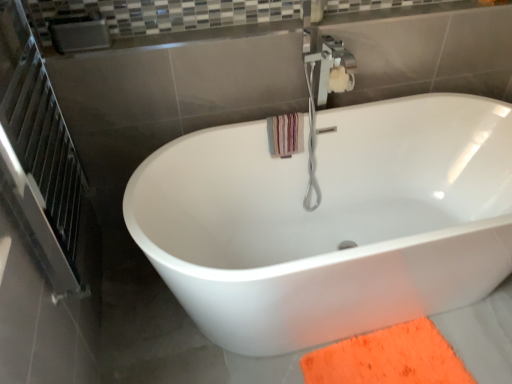
Question: Can you confirm if brushed metal balustrade at upper center is taller than metallic silver screen door at left?

Choices:
 (A) yes
 (B) no

Answer: (B)

Question: From a real-world perspective, is brushed metal balustrade at upper center physically below metallic silver screen door at left?

Choices:
 (A) yes
 (B) no

Answer: (B)

Question: Does brushed metal balustrade at upper center appear on the left side of metallic silver screen door at left?

Choices:
 (A) yes
 (B) no

Answer: (B)

Question: From the image's perspective, is brushed metal balustrade at upper center below metallic silver screen door at left?

Choices:
 (A) no
 (B) yes

Answer: (A)

Question: Does brushed metal balustrade at upper center have a greater width compared to metallic silver screen door at left?

Choices:
 (A) yes
 (B) no

Answer: (A)

Question: Is point (273, 160) closer or farther from the camera than point (416, 342)?

Choices:
 (A) farther
 (B) closer

Answer: (A)

Question: In terms of size, does white glossy bathtub at center appear bigger or smaller than orange fuzzy doormat at lower right?

Choices:
 (A) big
 (B) small

Answer: (A)

Question: From the image's perspective, is white glossy bathtub at center above or below orange fuzzy doormat at lower right?

Choices:
 (A) above
 (B) below

Answer: (A)

Question: From a real-world perspective, is white glossy bathtub at center positioned above or below orange fuzzy doormat at lower right?

Choices:
 (A) below
 (B) above

Answer: (B)

Question: From the image's perspective, is metallic silver screen door at left positioned above or below brushed metal balustrade at upper center?

Choices:
 (A) below
 (B) above

Answer: (A)

Question: Is metallic silver screen door at left inside the boundaries of brushed metal balustrade at upper center, or outside?

Choices:
 (A) inside
 (B) outside

Answer: (B)

Question: Is metallic silver screen door at left bigger or smaller than brushed metal balustrade at upper center?

Choices:
 (A) small
 (B) big

Answer: (B)

Question: Relative to brushed metal balustrade at upper center, is metallic silver screen door at left in front or behind?

Choices:
 (A) behind
 (B) front

Answer: (B)

Question: In terms of height, does striped cotton beach towel at upper right look taller or shorter compared to orange fuzzy doormat at lower right?

Choices:
 (A) tall
 (B) short

Answer: (A)

Question: From a real-world perspective, is striped cotton beach towel at upper right positioned above or below orange fuzzy doormat at lower right?

Choices:
 (A) below
 (B) above

Answer: (B)